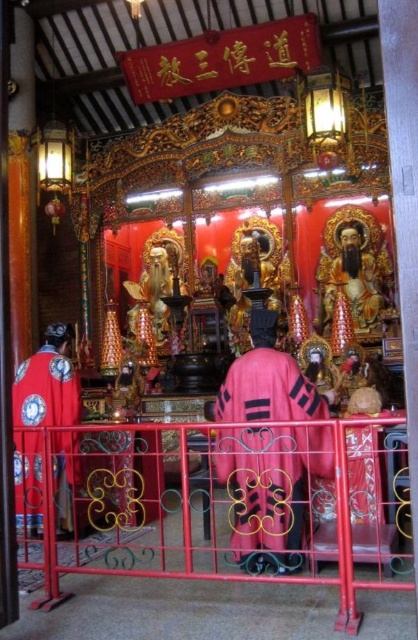
Question: Which of the following is the farthest from the observer?

Choices:
 (A) (56, 403)
 (B) (219, 458)

Answer: (A)

Question: Which point is closer to the camera?

Choices:
 (A) (73, 444)
 (B) (134, 548)

Answer: (B)

Question: Considering the relative positions of metallic red railing at center and velvet pink robe at center in the image provided, where is metallic red railing at center located with respect to velvet pink robe at center?

Choices:
 (A) above
 (B) below

Answer: (A)

Question: Which point is farther to the camera?

Choices:
 (A) coord(249,509)
 (B) coord(109,428)

Answer: (A)

Question: Is velvet pink robe at center further to camera compared to velvet red robe at left?

Choices:
 (A) yes
 (B) no

Answer: (B)

Question: In this image, where is metallic red railing at center located relative to velvet red robe at left?

Choices:
 (A) right
 (B) left

Answer: (A)